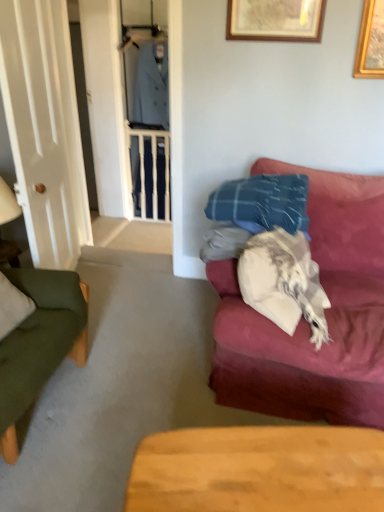
At what (x,y) coordinates should I click in order to perform the action: click on wooden table at lower center. Please return your answer as a coordinate pair (x, y). This screenshot has height=512, width=384. Looking at the image, I should click on (259, 470).

What is the approximate height of wooden table at lower center?

wooden table at lower center is 15.41 inches tall.

This screenshot has width=384, height=512. I want to click on wooden balustrade at center, so click(x=150, y=173).

Locate an element on the screen. wooden framed picture at upper center is located at coordinates (275, 20).

Does velvet red couch at right have a smaller size compared to wooden framed picture at upper center?

No, velvet red couch at right is not smaller than wooden framed picture at upper center.

Does velvet red couch at right have a greater height compared to wooden framed picture at upper center?

Indeed, velvet red couch at right has a greater height compared to wooden framed picture at upper center.

What's the angular difference between velvet red couch at right and wooden framed picture at upper center's facing directions?

There is a 0.64-degree angle between the facing directions of velvet red couch at right and wooden framed picture at upper center.

Between velvet red couch at right and wooden framed picture at upper center, which one has larger width?

velvet red couch at right.

From the picture: How many degrees apart are the facing directions of wooden balustrade at center and white glossy door at left?

wooden balustrade at center and white glossy door at left are facing 103 degrees away from each other.

From a real-world perspective, which is physically above, wooden balustrade at center or white glossy door at left?

In real-world perspective, white glossy door at left is above.

From the image's perspective, who appears lower, wooden balustrade at center or white glossy door at left?

white glossy door at left.

Find the location of a particular element. Image resolution: width=384 pixels, height=512 pixels. glass door that appears in front of the wooden balustrade at center is located at coordinates (44, 129).

In the scene shown: Considering the sizes of white glossy door at left and wooden framed picture at upper center in the image, is white glossy door at left taller or shorter than wooden framed picture at upper center?

Considering their sizes, white glossy door at left has more height than wooden framed picture at upper center.

Which of these two, white glossy door at left or wooden framed picture at upper center, is bigger?

Bigger between the two is white glossy door at left.

From a real-world perspective, is white glossy door at left beneath wooden framed picture at upper center?

Yes, from a real-world perspective, white glossy door at left is below wooden framed picture at upper center.

Can you confirm if wooden balustrade at center is shorter than velvet red couch at right?

Incorrect, the height of wooden balustrade at center does not fall short of that of velvet red couch at right.

Considering the relative sizes of wooden balustrade at center and velvet red couch at right in the image provided, is wooden balustrade at center wider than velvet red couch at right?

No, wooden balustrade at center is not wider than velvet red couch at right.

Considering the positions of objects wooden balustrade at center and velvet red couch at right in the image provided, who is in front, wooden balustrade at center or velvet red couch at right?

velvet red couch at right is closer to the camera.

Considering the sizes of wooden framed picture at upper center and white glossy door at left in the image, is wooden framed picture at upper center taller or shorter than white glossy door at left?

In the image, wooden framed picture at upper center appears to be shorter than white glossy door at left.

Is wooden framed picture at upper center positioned with its back to white glossy door at left?

No, wooden framed picture at upper center is not facing away from white glossy door at left.

Locate an element on the screen. picture frame located on the right of white glossy door at left is located at coordinates (275, 20).

In the image, is white glossy door at left positioned in front of or behind wooden table at lower center?

Clearly, white glossy door at left is behind wooden table at lower center.

Is white glossy door at left facing towards wooden table at lower center?

No, white glossy door at left is not facing towards wooden table at lower center.

Based on the photo, which object is wider, white glossy door at left or wooden table at lower center?

wooden table at lower center is wider.

Can you confirm if wooden table at lower center is wider than wooden framed picture at upper center?

Yes, wooden table at lower center is wider than wooden framed picture at upper center.

Is wooden table at lower center not inside wooden framed picture at upper center?

Absolutely, wooden table at lower center is external to wooden framed picture at upper center.

Is wooden table at lower center oriented away from wooden framed picture at upper center?

No, wooden table at lower center is not facing the opposite direction of wooden framed picture at upper center.

In the scene shown: From the image's perspective, which one is positioned lower, wooden table at lower center or wooden framed picture at upper center?

wooden table at lower center is shown below in the image.

Where is `picture frame behind the velvet red couch at right`? Image resolution: width=384 pixels, height=512 pixels. picture frame behind the velvet red couch at right is located at coordinates (275, 20).

Image resolution: width=384 pixels, height=512 pixels. Find the location of `glass door above the wooden balustrade at center (from a real-world perspective)`. glass door above the wooden balustrade at center (from a real-world perspective) is located at coordinates (44, 129).

From the image, which object appears to be farther from velvet red couch at right, wooden table at lower center or wooden balustrade at center?

wooden balustrade at center is positioned further to the anchor velvet red couch at right.

When comparing their distances from wooden balustrade at center, does white glossy door at left or wooden table at lower center seem closer?

white glossy door at left lies closer to wooden balustrade at center than the other object.

From the image, which object appears to be farther from wooden balustrade at center, wooden table at lower center or velvet red couch at right?

Among the two, wooden table at lower center is located further to wooden balustrade at center.

Looking at the image, which one is located closer to velvet red couch at right, wooden framed picture at upper center or wooden balustrade at center?

The object closer to velvet red couch at right is wooden framed picture at upper center.

Estimate the real-world distances between objects in this image. Which object is further from wooden framed picture at upper center, wooden table at lower center or velvet red couch at right?

wooden table at lower center is positioned further to the anchor wooden framed picture at upper center.

Considering their positions, is white glossy door at left positioned further to wooden table at lower center than velvet red couch at right?

white glossy door at left is further to wooden table at lower center.

Which object lies nearer to the anchor point white glossy door at left, wooden table at lower center or velvet red couch at right?

velvet red couch at right is positioned closer to the anchor white glossy door at left.

Which object lies nearer to the anchor point wooden table at lower center, wooden balustrade at center or white glossy door at left?

The object closer to wooden table at lower center is white glossy door at left.

Find the location of `picture frame located between wooden table at lower center and wooden balustrade at center in the depth direction`. picture frame located between wooden table at lower center and wooden balustrade at center in the depth direction is located at coordinates (275, 20).

Identify the location of studio couch between white glossy door at left and wooden table at lower center in the vertical direction. (305, 320).

Where is `glass door between wooden table at lower center and wooden balustrade at center from front to back`? The width and height of the screenshot is (384, 512). glass door between wooden table at lower center and wooden balustrade at center from front to back is located at coordinates (44, 129).

This screenshot has width=384, height=512. In order to click on studio couch that lies between wooden framed picture at upper center and wooden table at lower center from top to bottom in this screenshot , I will do 305,320.